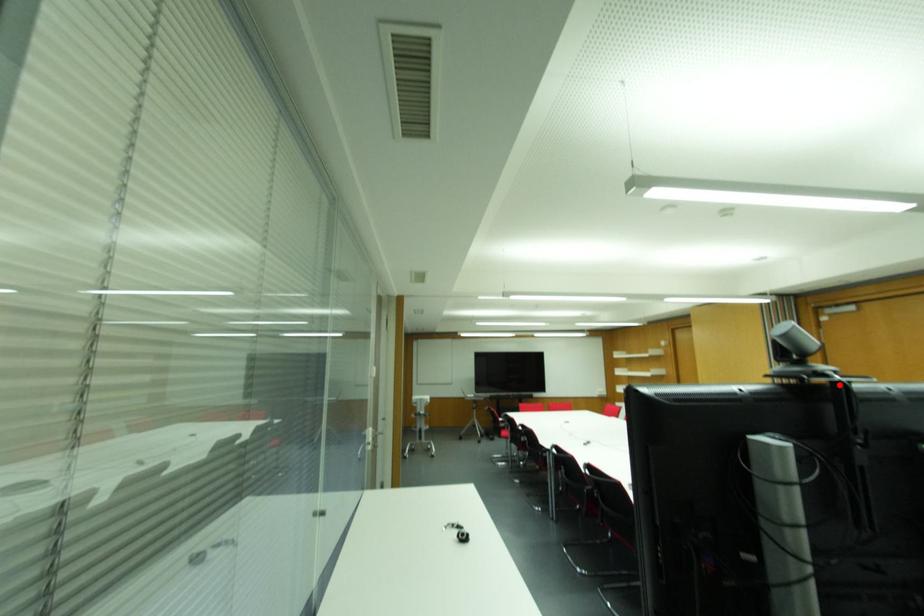
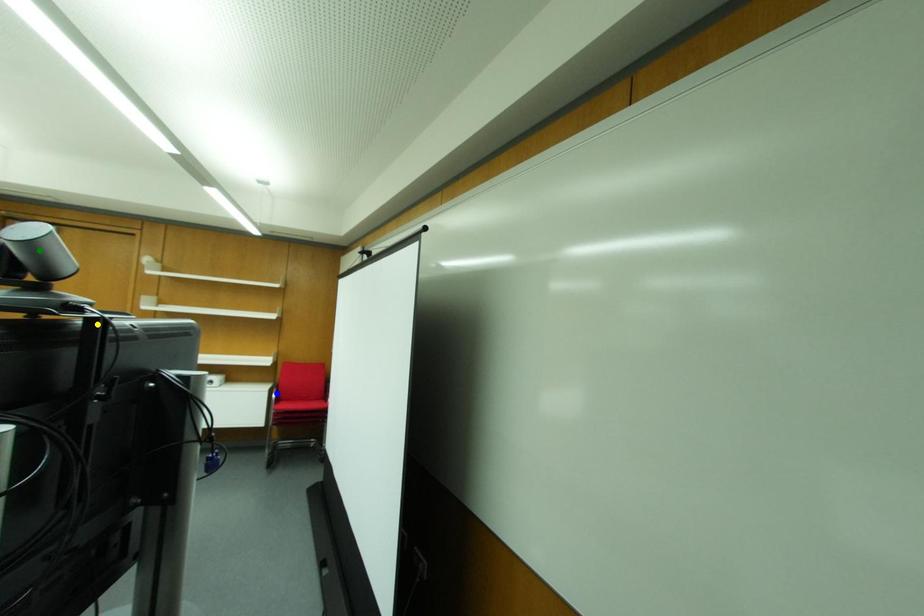
Question: I am providing you with two images of the same scene from different viewpoints. A red point is marked on the first image. You are given multiple points on the second image. Which spot in image 2 lines up with the point in image 1?

Choices:
 (A) yellow point
 (B) green point
 (C) blue point

Answer: (A)